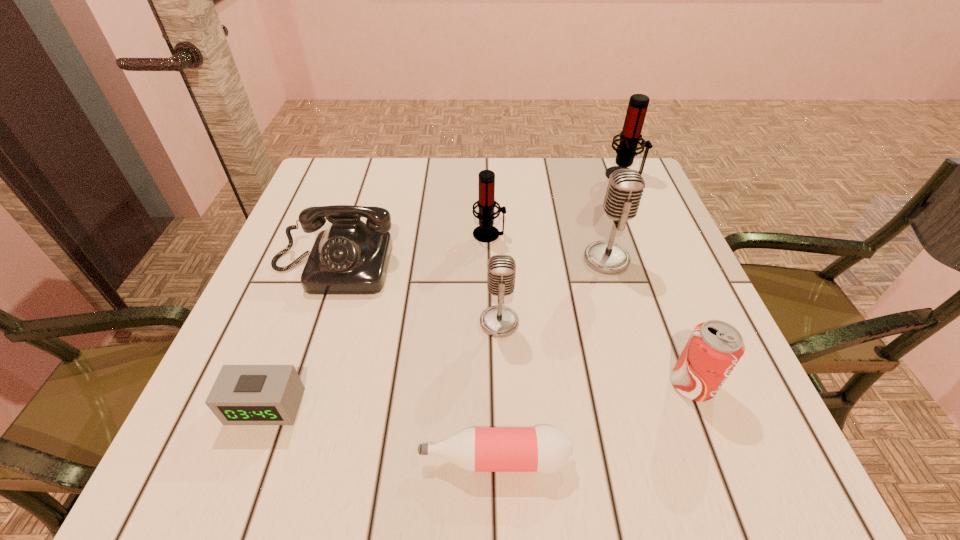
At what (x,y) coordinates should I click in order to perform the action: click on alarm clock. Please return your answer as a coordinate pair (x, y). The width and height of the screenshot is (960, 540). Looking at the image, I should click on (242, 394).

This screenshot has height=540, width=960. What are the coordinates of `bottle` in the screenshot? It's located at (545, 449).

Where is `pink bottle`? Image resolution: width=960 pixels, height=540 pixels. pink bottle is located at coordinates (545, 449).

Locate an element on the screen. The height and width of the screenshot is (540, 960). blank area located on the front of the farthest microphone is located at coordinates (661, 264).

The image size is (960, 540). What are the coordinates of `vacant region located 0.150m on the back of the third microphone from left to right` in the screenshot? It's located at (590, 205).

Find the location of `vacant space located 0.270m on the front of the smaller red microphone`. vacant space located 0.270m on the front of the smaller red microphone is located at coordinates (492, 338).

The height and width of the screenshot is (540, 960). I want to click on vacant area located on the left of the nearest microphone, so tap(311, 322).

I want to click on free location located on the front of the soda can, so click(718, 453).

Locate an element on the screen. The image size is (960, 540). free location located on the dial of the black telephone is located at coordinates (306, 343).

This screenshot has height=540, width=960. In order to click on vacant space situated on the front-facing side of the alarm clock in this screenshot , I will do `click(239, 478)`.